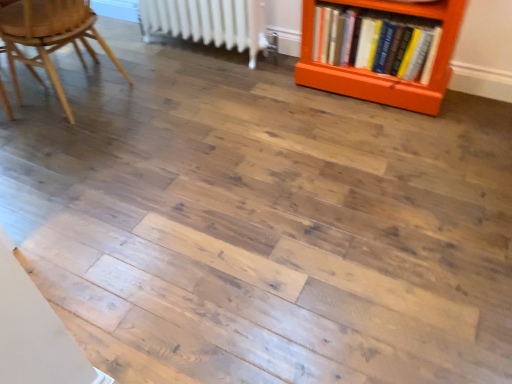
I want to click on free space to the left of white metallic radiator at upper center, so click(135, 55).